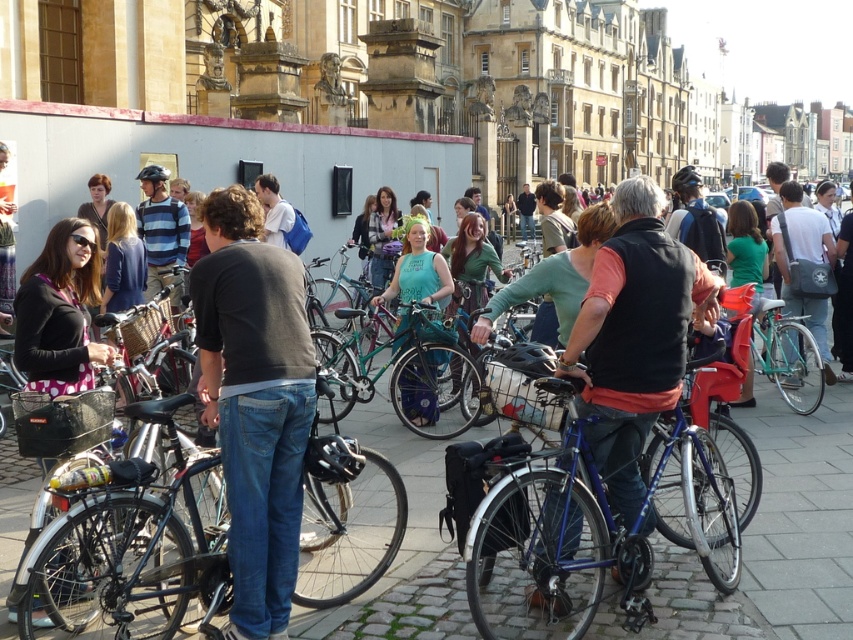
You are standing in the square and want to take a photo of both the point at coordinates point [488,561] and the point at coordinates point [350,317]. Which point should you focus on first to ensure both are in sharp focus?

You should focus on the point at coordinates point [488,561] first because it is closer to the camera. This ensures that the closer point is in focus, and the farther point at coordinates point [350,317] will also be within the depth of field.

You are a delivery person who needs to choose between the blue metallic bicycle at center and the shiny metallic bicycle at center for a job that requires carrying heavy packages. Which bicycle would be more suitable based on their height?

The blue metallic bicycle at center has a greater height compared to the shiny metallic bicycle at center, making it more suitable for carrying heavy packages as its taller frame may provide better stability and ease of access.